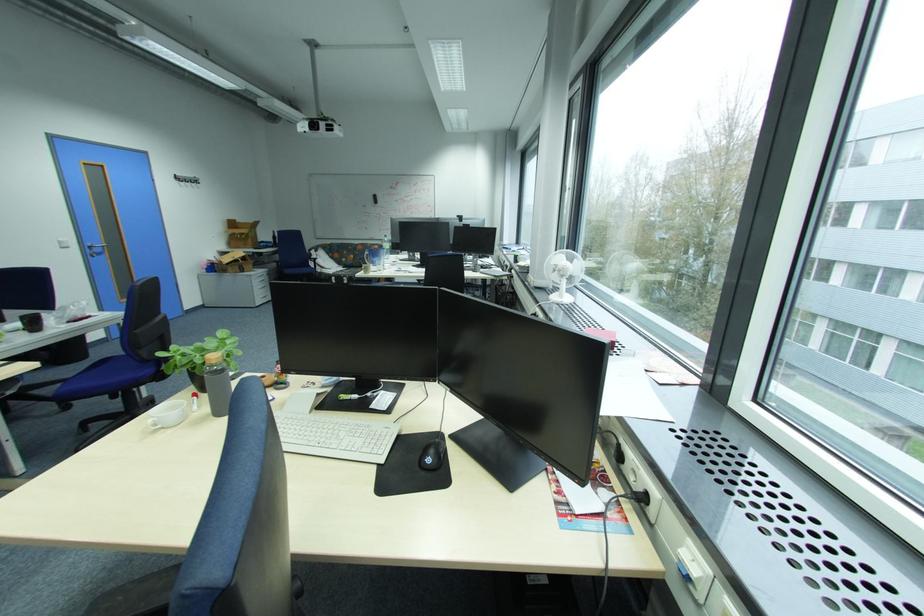
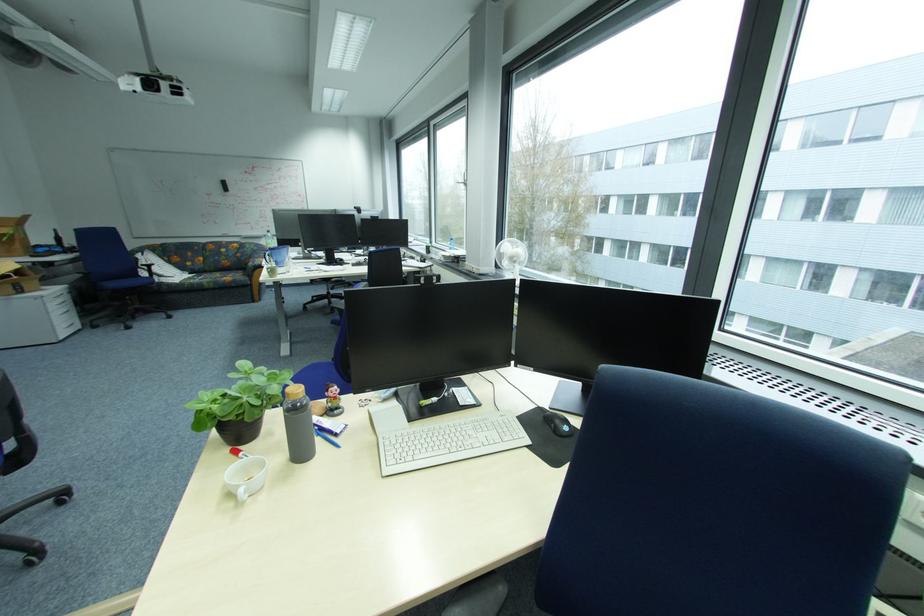
Question: I am providing you with two images of the same scene from different viewpoints. After the viewpoint changes to image2, which objects are now occluded?

Choices:
 (A) white ceramic cup handle
 (B) computer mouse
 (C) black whiteboard eraser
 (D) none of these

Answer: (D)